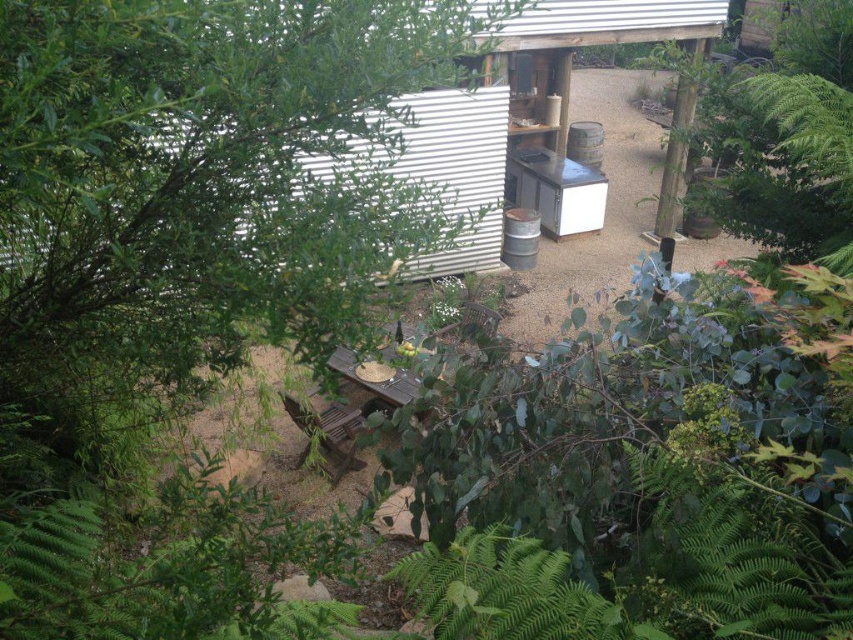
Is metallic corrugated hut at upper center to the right of brown wooden picnic table at center from the viewer's perspective?

Correct, you'll find metallic corrugated hut at upper center to the right of brown wooden picnic table at center.

Who is taller, metallic corrugated hut at upper center or brown wooden picnic table at center?

Standing taller between the two is brown wooden picnic table at center.

Where is `metallic corrugated hut at upper center`? metallic corrugated hut at upper center is located at coordinates (505, 113).

Where is `metallic corrugated hut at upper center`? Image resolution: width=853 pixels, height=640 pixels. metallic corrugated hut at upper center is located at coordinates (505, 113).